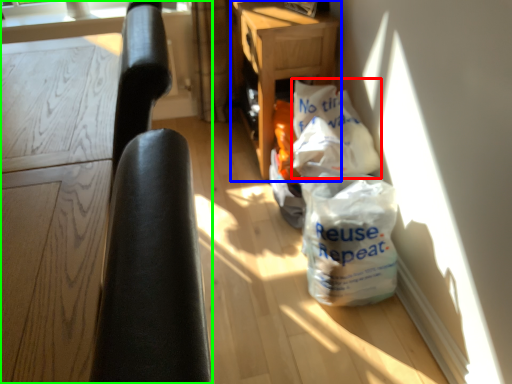
Question: Estimate the real-world distances between objects in this image. Which object is closer to grocery bag (highlighted by a red box), table (highlighted by a blue box) or furniture (highlighted by a green box)?

Choices:
 (A) table
 (B) furniture

Answer: (A)